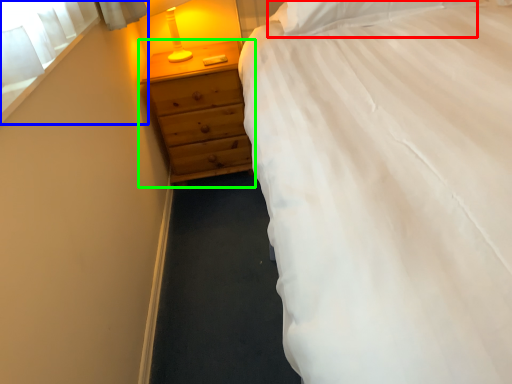
Question: Based on their relative distances, which object is farther from pillow (highlighted by a red box)? Choose from window screen (highlighted by a blue box) and chest of drawers (highlighted by a green box).

Choices:
 (A) window screen
 (B) chest of drawers

Answer: (A)